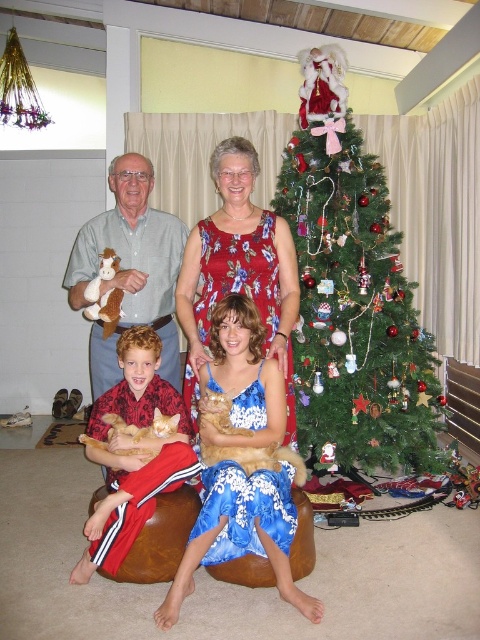
Question: Is floral fabric dress at center bigger than white plush cow at left?

Choices:
 (A) no
 (B) yes

Answer: (B)

Question: Estimate the real-world distances between objects in this image. Which object is closer to the floral fabric dress at center?

Choices:
 (A) blue floral dress at center
 (B) orange fur cat at lower left

Answer: (A)

Question: In this image, where is orange fur cat at left located relative to orange fur cat at lower left?

Choices:
 (A) right
 (B) left

Answer: (A)

Question: Considering the real-world distances, which object is closest to the orange fur cat at left?

Choices:
 (A) green textured christmas tree at center
 (B) blue floral dress at center
 (C) orange fur cat at lower left
 (D) floral fabric dress at center

Answer: (C)

Question: Can you confirm if floral fabric dress at center is wider than blue floral dress at center?

Choices:
 (A) no
 (B) yes

Answer: (A)

Question: Which point is closer to the camera?

Choices:
 (A) fluffy orange cat at center
 (B) green textured christmas tree at center

Answer: (A)